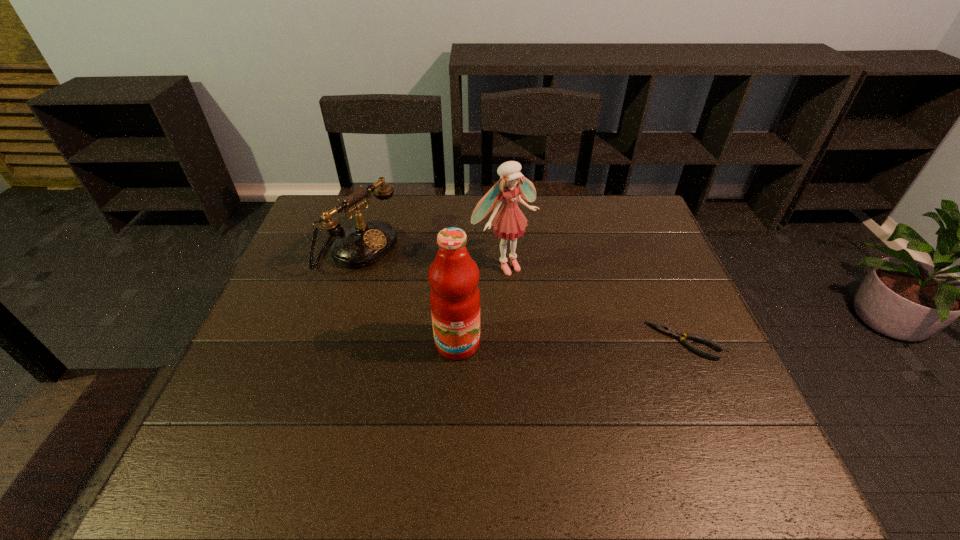
Where is `vacant area at the left edge`? vacant area at the left edge is located at coordinates (297, 382).

This screenshot has width=960, height=540. In the image, there is a desktop. Identify the location of free space at the right edge. (615, 241).

At what (x,y) coordinates should I click in order to perform the action: click on vacant space at the far left corner. Please return your answer as a coordinate pair (x, y). Looking at the image, I should click on (313, 230).

The width and height of the screenshot is (960, 540). In the image, there is a desktop. What are the coordinates of `vacant space at the near left corner` in the screenshot? It's located at (244, 424).

In the image, there is a desktop. Identify the location of vacant space at the far right corner. (656, 226).

In the image, there is a desktop. At what (x,y) coordinates should I click in order to perform the action: click on free space at the near right corner. Please return your answer as a coordinate pair (x, y). Looking at the image, I should click on (684, 399).

Identify the location of vacant space that is in between the second shortest object and the rightmost object. The width and height of the screenshot is (960, 540). (521, 295).

At what (x,y) coordinates should I click in order to perform the action: click on vacant space that is in between the second shortest object and the fruit juice. Please return your answer as a coordinate pair (x, y). The width and height of the screenshot is (960, 540). Looking at the image, I should click on (408, 296).

Find the location of a particular element. vacant area that lies between the doll and the fruit juice is located at coordinates (481, 303).

Find the location of `vacant space that's between the fruit juice and the rightmost object`. vacant space that's between the fruit juice and the rightmost object is located at coordinates (570, 342).